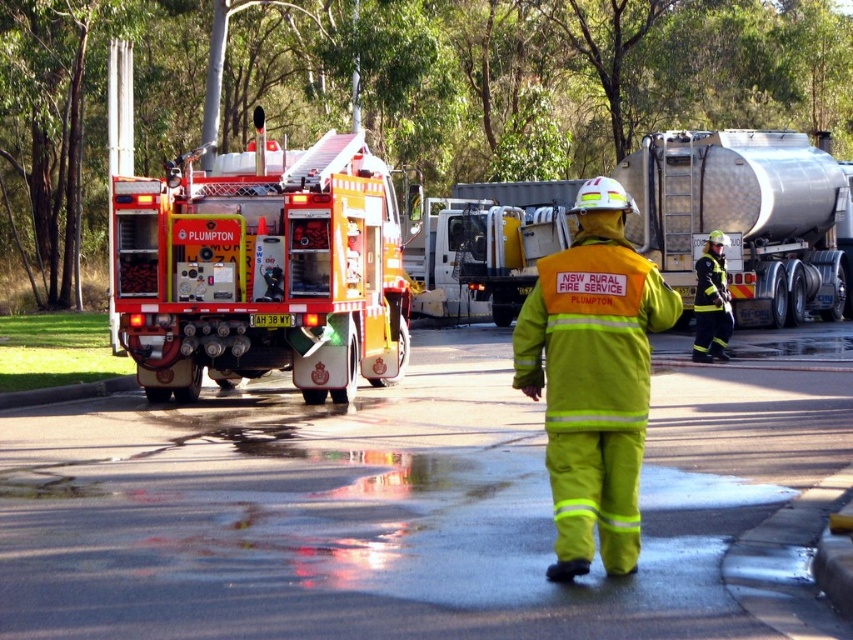
Between yellow reflective fire truck at center and polished silver trailer truck at upper right, which one appears on the right side from the viewer's perspective?

Positioned to the right is polished silver trailer truck at upper right.

Does point (335, 372) come farther from viewer compared to point (804, 269)?

No, (335, 372) is closer to viewer.

Where is `yellow reflective fire truck at center`? The height and width of the screenshot is (640, 853). yellow reflective fire truck at center is located at coordinates (262, 269).

Where is `bright yellow reflective uniform at center`? bright yellow reflective uniform at center is located at coordinates tap(593, 378).

Is point (619, 396) positioned in front of point (801, 168)?

Yes, point (619, 396) is closer to viewer.

The width and height of the screenshot is (853, 640). Find the location of `bright yellow reflective uniform at center`. bright yellow reflective uniform at center is located at coordinates (593, 378).

Is bright yellow reflective uniform at center wider than yellow reflective uniform at center?

Yes.

Describe the element at coordinates (593, 378) in the screenshot. I see `bright yellow reflective uniform at center` at that location.

Image resolution: width=853 pixels, height=640 pixels. In order to click on bright yellow reflective uniform at center in this screenshot , I will do `click(593, 378)`.